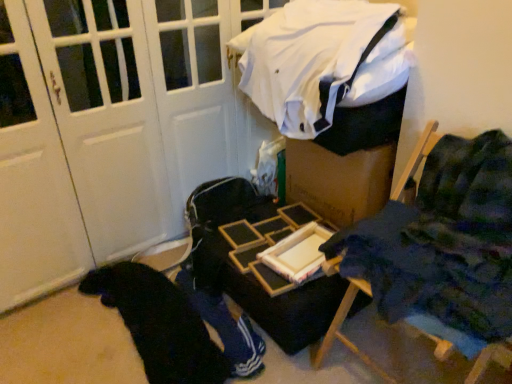
Question: Is blue fabric chair at right bigger than wooden tray at center?

Choices:
 (A) yes
 (B) no

Answer: (A)

Question: Can you confirm if blue fabric chair at right is smaller than wooden tray at center?

Choices:
 (A) no
 (B) yes

Answer: (A)

Question: Is blue fabric chair at right to the right of wooden tray at center from the viewer's perspective?

Choices:
 (A) no
 (B) yes

Answer: (B)

Question: Could you tell me if blue fabric chair at right is facing wooden tray at center?

Choices:
 (A) yes
 (B) no

Answer: (B)

Question: From a real-world perspective, is blue fabric chair at right beneath wooden tray at center?

Choices:
 (A) yes
 (B) no

Answer: (B)

Question: Looking at their shapes, would you say white fabric at upper center is wider or thinner than wooden tray at center?

Choices:
 (A) wide
 (B) thin

Answer: (B)

Question: Relative to wooden tray at center, is white fabric at upper center in front or behind?

Choices:
 (A) behind
 (B) front

Answer: (B)

Question: Do you think white fabric at upper center is within wooden tray at center, or outside of it?

Choices:
 (A) outside
 (B) inside

Answer: (A)

Question: From a real-world perspective, is white fabric at upper center positioned above or below wooden tray at center?

Choices:
 (A) below
 (B) above

Answer: (B)

Question: Considering the positions of black fabric at lower left and white fabric at upper center in the image, is black fabric at lower left wider or thinner than white fabric at upper center?

Choices:
 (A) wide
 (B) thin

Answer: (A)

Question: In the image, is black fabric at lower left positioned in front of or behind white fabric at upper center?

Choices:
 (A) front
 (B) behind

Answer: (B)

Question: Do you think black fabric at lower left is within white fabric at upper center, or outside of it?

Choices:
 (A) inside
 (B) outside

Answer: (B)

Question: Is point (174, 347) closer or farther from the camera than point (245, 87)?

Choices:
 (A) farther
 (B) closer

Answer: (B)

Question: Is point (267, 314) positioned closer to the camera than point (302, 8)?

Choices:
 (A) farther
 (B) closer

Answer: (B)

Question: Is wooden tray at center wider or thinner than white fabric at upper center?

Choices:
 (A) thin
 (B) wide

Answer: (B)